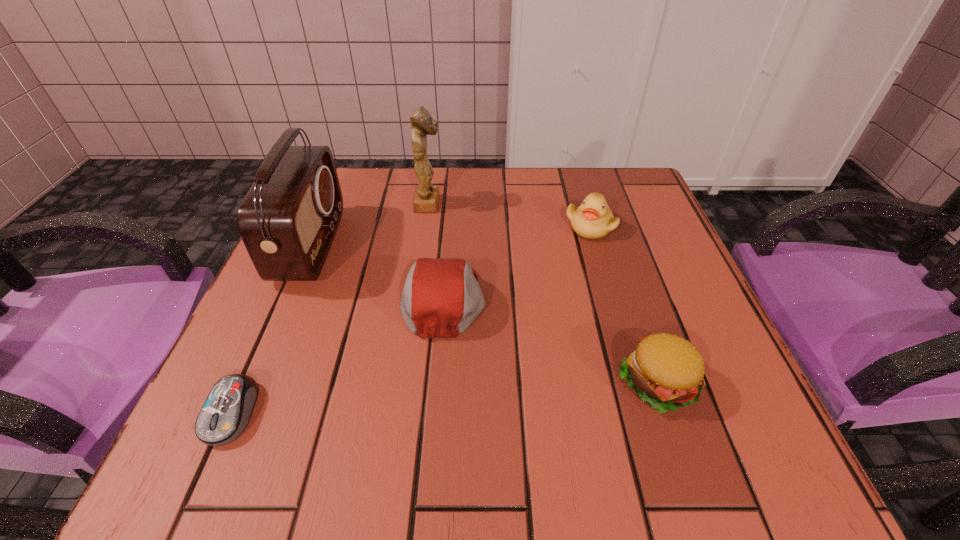
Locate which object is the third closest to the figurine. Please provide its 2D coordinates. Your answer should be formatted as a tuple, i.e. [(x, y)], where the tuple contains the x and y coordinates of a point satisfying the conditions above.

[(593, 219)]

In order to click on vacant position in the image that satisfies the following two spatial constraints: 1. on the front-facing side of the hamburger; 2. on the left side of the cap in this screenshot , I will do `click(437, 382)`.

Locate an element on the screen. blank space that satisfies the following two spatial constraints: 1. on the front-facing side of the figurine; 2. on the back side of the hamburger is located at coordinates (403, 382).

Locate an element on the screen. free space in the image that satisfies the following two spatial constraints: 1. on the beak of the duckling; 2. on the front-facing side of the cap is located at coordinates (612, 299).

At what (x,y) coordinates should I click in order to perform the action: click on free location that satisfies the following two spatial constraints: 1. on the front panel of the radio receiver; 2. on the wheel side of the computer mouse. Please return your answer as a coordinate pair (x, y). This screenshot has width=960, height=540. Looking at the image, I should click on (239, 413).

This screenshot has height=540, width=960. What are the coordinates of `free space that satisfies the following two spatial constraints: 1. on the front-facing side of the hamburger; 2. on the right side of the figurine` in the screenshot? It's located at (403, 382).

Locate an element on the screen. This screenshot has width=960, height=540. vacant point that satisfies the following two spatial constraints: 1. on the beak of the duckling; 2. on the front-facing side of the cap is located at coordinates (612, 299).

The image size is (960, 540). Identify the location of free space that satisfies the following two spatial constraints: 1. on the front-facing side of the figurine; 2. on the wheel side of the shortest object. (399, 413).